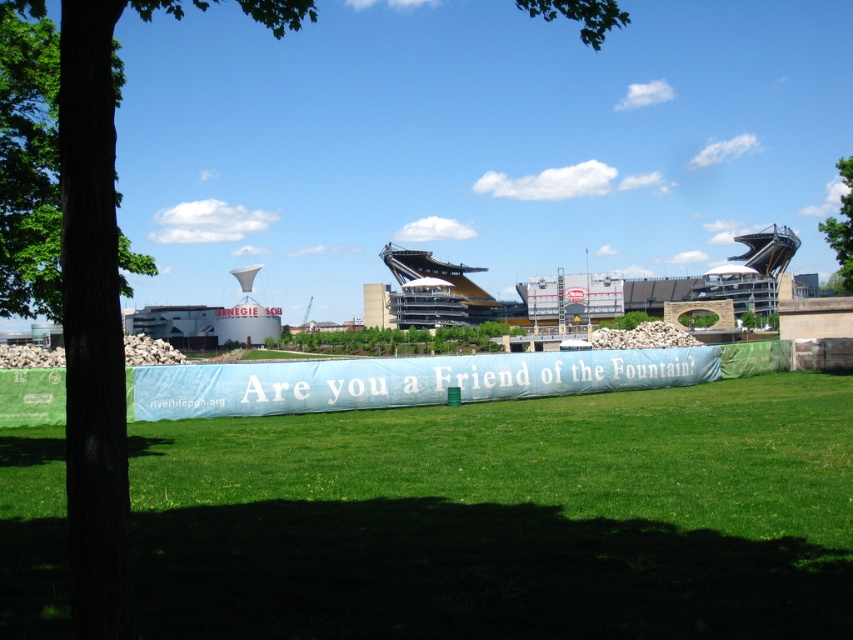
Question: Can you confirm if green leafy tree at center-left is smaller than green leafy tree at upper right?

Choices:
 (A) yes
 (B) no

Answer: (A)

Question: Is green leafy tree at center-left in front of green rough bark tree at left?

Choices:
 (A) yes
 (B) no

Answer: (A)

Question: Estimate the real-world distances between objects in this image. Which object is farther from the green rough bark tree at left?

Choices:
 (A) green leafy tree at center
 (B) green leafy tree at upper right

Answer: (A)

Question: Is green leafy tree at center smaller than green leafy tree at upper right?

Choices:
 (A) no
 (B) yes

Answer: (B)

Question: Which object is the farthest from the green leafy tree at center?

Choices:
 (A) green leafy tree at upper right
 (B) green rough bark tree at left
 (C) green leafy tree at center-left

Answer: (B)

Question: Which object is the closest to the green leafy tree at center?

Choices:
 (A) green rough bark tree at left
 (B) green leafy tree at center-left
 (C) green leafy tree at upper right

Answer: (C)